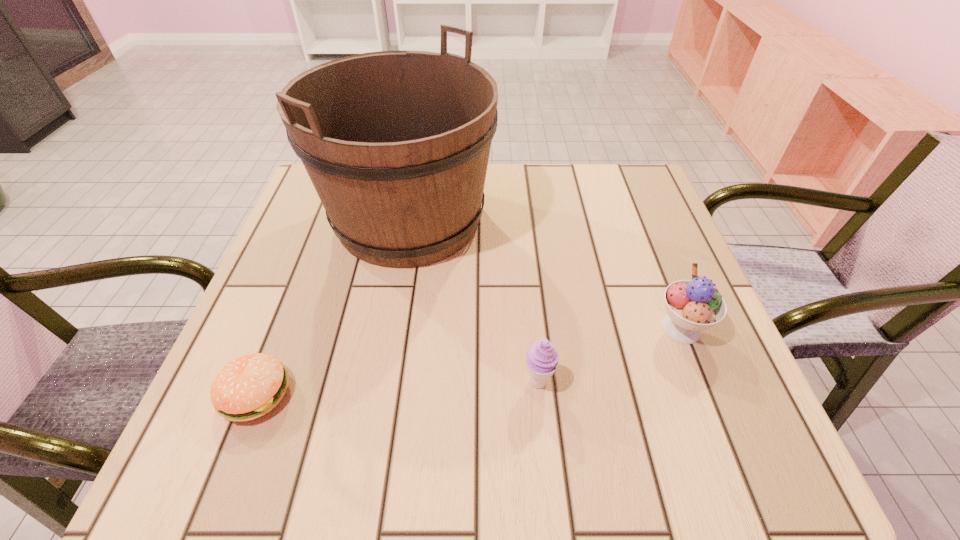
Locate an element on the screen. This screenshot has height=540, width=960. vacant space that satisfies the following two spatial constraints: 1. on the front side of the right icecream; 2. on the right side of the bucket is located at coordinates (390, 328).

Where is `free point that satisfies the following two spatial constraints: 1. on the back side of the patty; 2. on the right side of the third nearest object`? This screenshot has height=540, width=960. free point that satisfies the following two spatial constraints: 1. on the back side of the patty; 2. on the right side of the third nearest object is located at coordinates (281, 328).

Where is `free space that satisfies the following two spatial constraints: 1. on the back side of the farther icecream; 2. on the right side of the nearer icecream`? free space that satisfies the following two spatial constraints: 1. on the back side of the farther icecream; 2. on the right side of the nearer icecream is located at coordinates (533, 328).